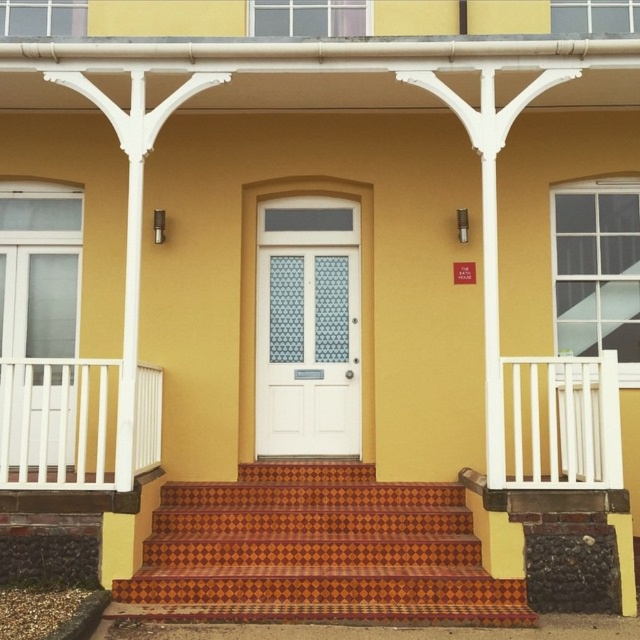
You are a delivery person carrying a large package that is 2.5 meters wide. You need to walk through the entrance while avoiding the white wooden balustrade at left and the white wooden balustrade at right. Can you pass through the entrance without hitting the balustrades?

The white wooden balustrade at left and white wooden balustrade at right are 3.00 meters apart, so the delivery person can pass through the entrance with the 2.5 meters wide package without hitting the balustrades since the distance between them is sufficient.

You are a delivery person approaching the entrance of the building. You need to place a heavy box on the ground near the white wooden balustrade at left. However, the stairs are covered with terracotta checkered tile stairs at center. Can you place the box on the stairs without stepping onto the tiles?

The terracotta checkered tile stairs at center is in front of the white wooden balustrade at left. Since the stairs are in front of the balustrade, you cannot place the box on the stairs without stepping onto the tiles because the stairs are between you and the balustrade.

You are a delivery person trying to enter the building. The entrance has a white glossy door at center and a white wooden balustrade at right. Which object is taller?

The white glossy door at center is much taller than the white wooden balustrade at right.